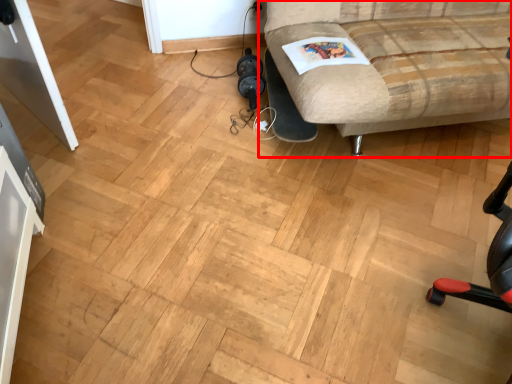
Question: Considering the relative positions of studio couch (annotated by the red box) and magazine in the image provided, where is studio couch (annotated by the red box) located with respect to the staircase?

Choices:
 (A) left
 (B) right

Answer: (B)